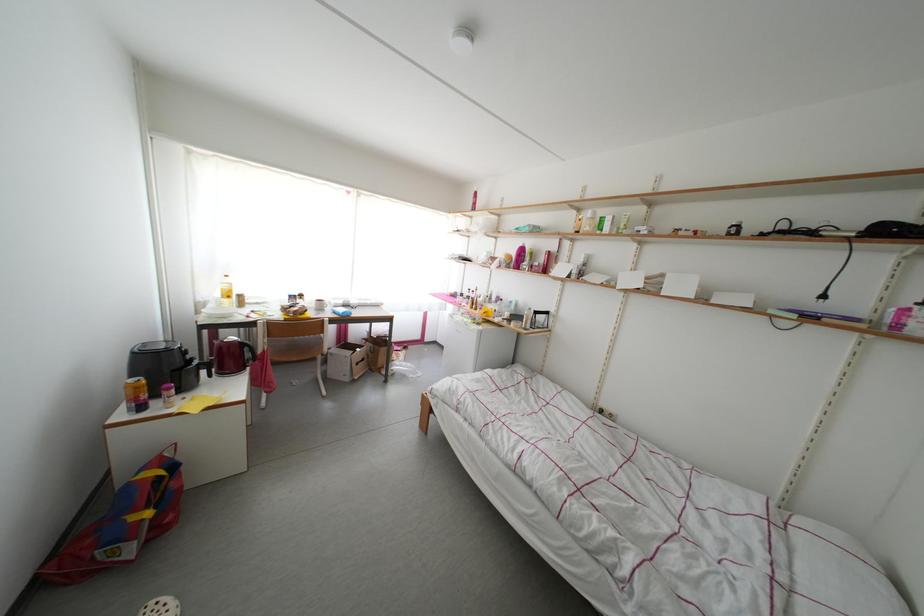
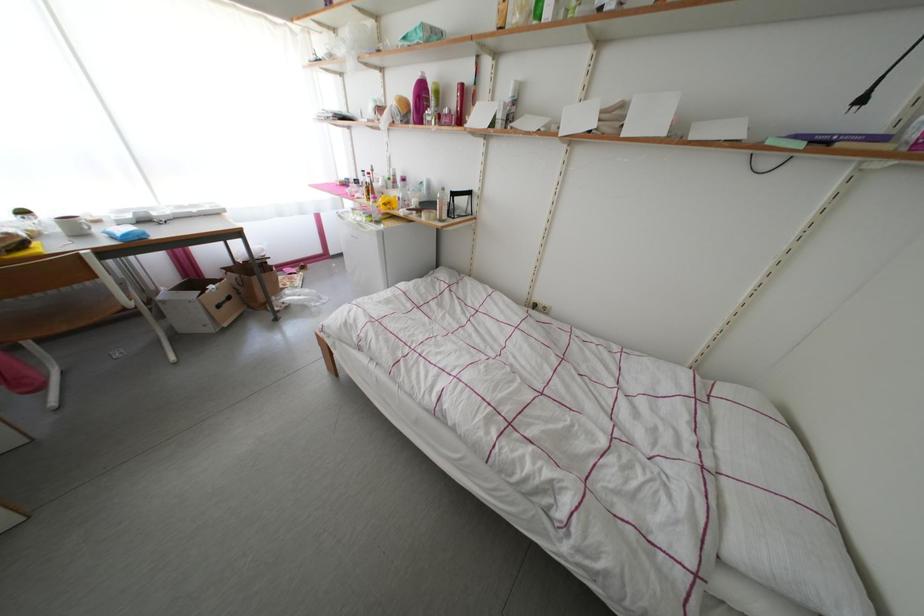
Question: The images are taken continuously from a first-person perspective. In which direction is your viewpoint rotating?

Choices:
 (A) Left
 (B) Right
 (C) Up
 (D) Down

Answer: (D)